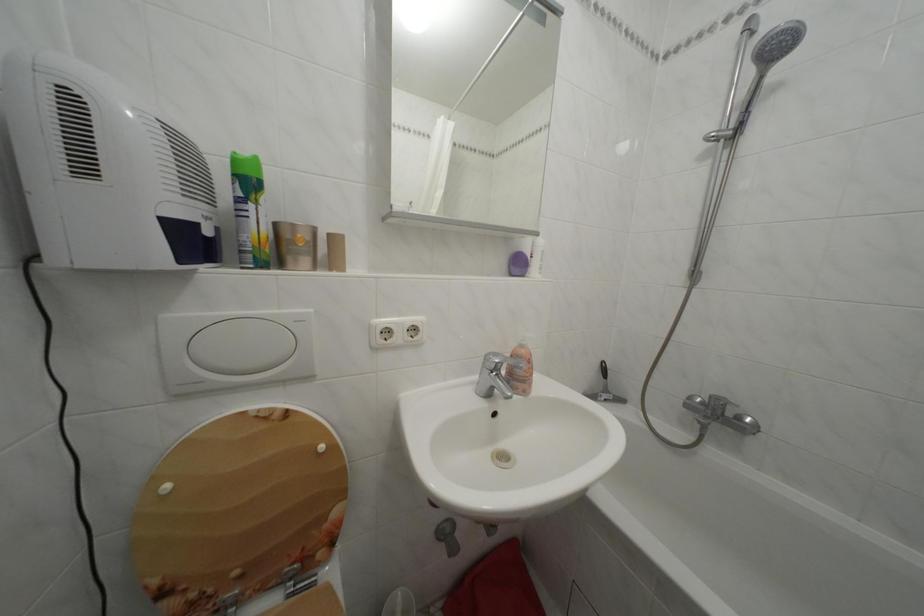
Find where to lift the patterned toilet lid. Please return your answer as a coordinate pair (x, y).

(242, 514)